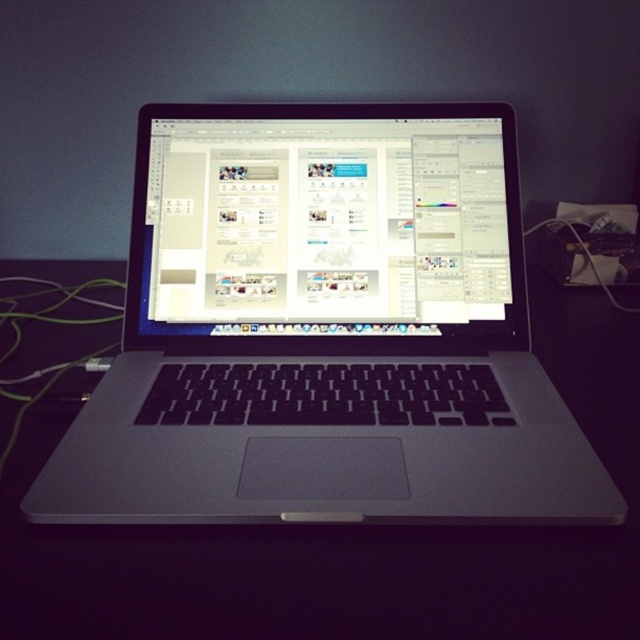
How far apart are black matte table at center and satin silver laptop at center?

21.24 centimeters

Can you confirm if black matte table at center is positioned to the right of satin silver laptop at center?

In fact, black matte table at center is to the left of satin silver laptop at center.

The height and width of the screenshot is (640, 640). Find the location of `black matte table at center`. black matte table at center is located at coordinates coord(348,538).

The image size is (640, 640). What are the coordinates of `black matte table at center` in the screenshot? It's located at (348, 538).

Which is above, sleek silver laptop at center or black matte table at center?

sleek silver laptop at center

Is sleek silver laptop at center positioned at the back of black matte table at center?

Yes, it is.

Where is `sleek silver laptop at center`? The image size is (640, 640). sleek silver laptop at center is located at coordinates (324, 330).

Identify the location of sleek silver laptop at center. (324, 330).

Is sleek silver laptop at center to the right of satin silver laptop at center from the viewer's perspective?

In fact, sleek silver laptop at center is to the left of satin silver laptop at center.

Is sleek silver laptop at center taller than satin silver laptop at center?

Indeed, sleek silver laptop at center has a greater height compared to satin silver laptop at center.

Is point (147, 332) farther from camera compared to point (216, 180)?

No, (147, 332) is in front of (216, 180).

The image size is (640, 640). I want to click on sleek silver laptop at center, so click(x=324, y=330).